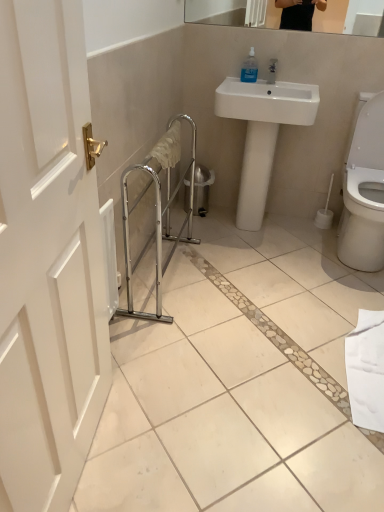
Question: From a real-world perspective, is chrome metallic balustrade at center positioned above or below transparent plastic soap dispenser at upper center?

Choices:
 (A) above
 (B) below

Answer: (B)

Question: Is chrome metallic balustrade at center wider or thinner than transparent plastic soap dispenser at upper center?

Choices:
 (A) thin
 (B) wide

Answer: (B)

Question: Considering the real-world distances, which object is farthest from the chrome metallic balustrade at center?

Choices:
 (A) transparent plastic soap dispenser at upper center
 (B) white glossy sink at center

Answer: (A)

Question: Based on their relative distances, which object is farther from the chrome metallic balustrade at center?

Choices:
 (A) white glossy sink at center
 (B) transparent plastic soap dispenser at upper center

Answer: (B)